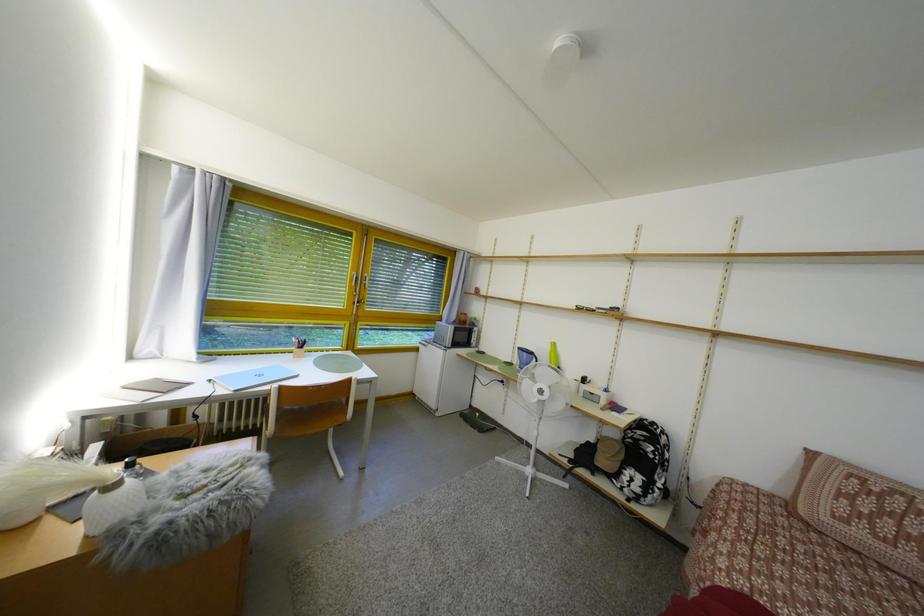
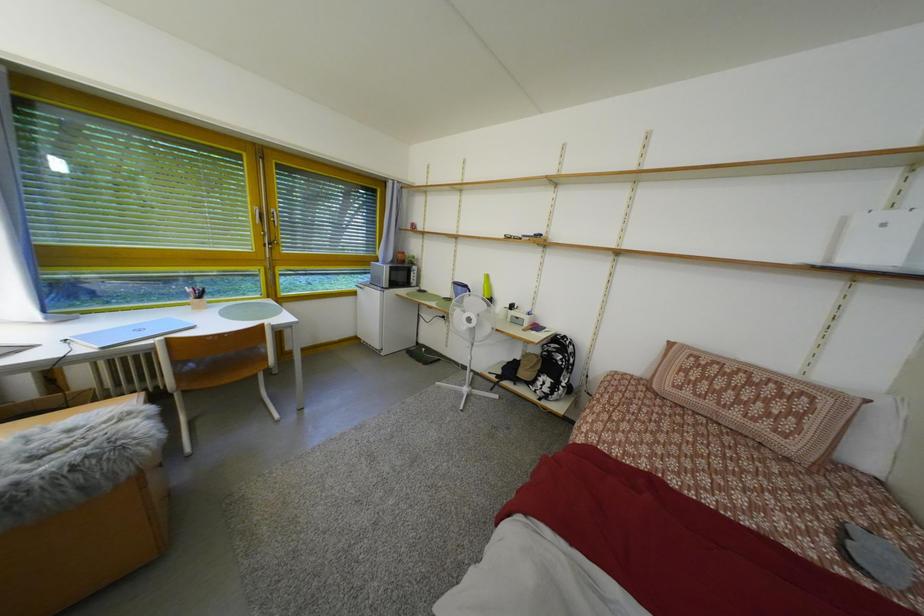
Question: Based on the continuous images, in which direction is the camera rotating? Reply with the corresponding letter.

Choices:
 (A) Left
 (B) Right
 (C) Up
 (D) Down

Answer: (D)